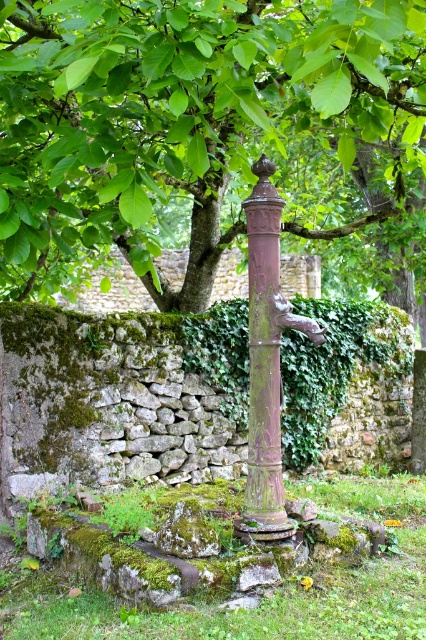
You are standing in the rustic outdoor scene with the red metal water pump. You see two points marked in the image. Which point, point (x=354, y=84) or point (x=250, y=248), is closer to you?

Point (x=354, y=84) is closer to the viewer than point (x=250, y=248).

You are standing in front of the weathered red metal water pump and want to reach both the green leafy tree at center and the rusty metal pole at center. Which object should you approach first to get to the one farther away without passing the other?

You should approach the green leafy tree at center first because it is closer to you than the rusty metal pole at center. After reaching the tree, you can move past it to get to the farther pole.